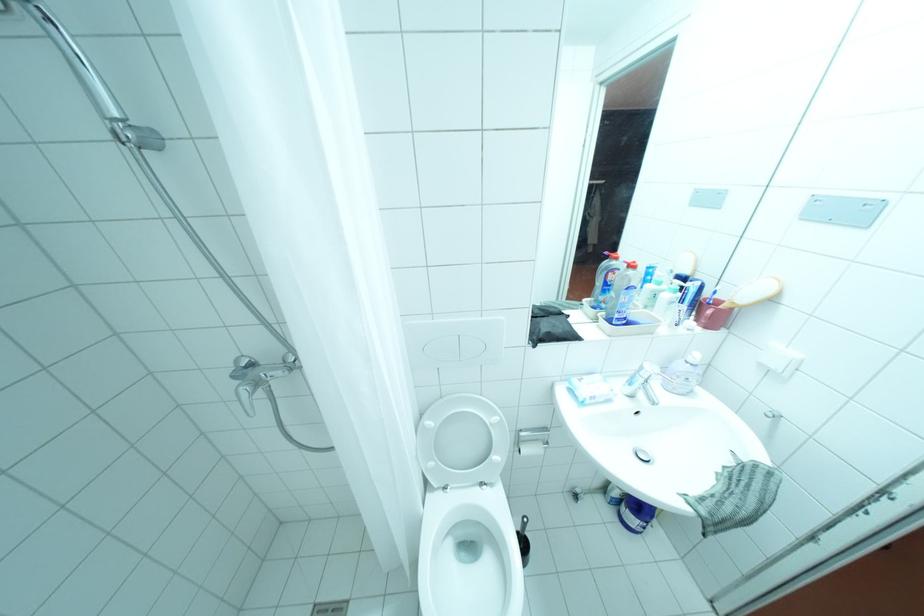
What do you see at coordinates (466, 513) in the screenshot? I see `a white toilet seat` at bounding box center [466, 513].